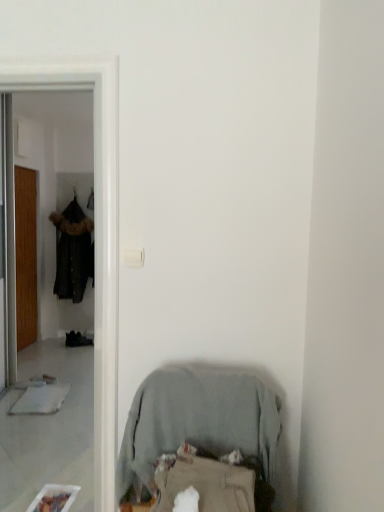
This screenshot has width=384, height=512. What do you see at coordinates (198, 420) in the screenshot?
I see `light gray fabric chair at lower center` at bounding box center [198, 420].

This screenshot has height=512, width=384. Identify the location of transparent plastic screen door at left. (95, 239).

You are a GUI agent. You are given a task and a screenshot of the screen. Output one action in this format:
    pyautogui.click(x=<x>, y=<y>)
    Task: Click on the dark brown fur-trimmed coat at left
    The image size is (384, 512).
    Given the screenshot: What is the action you would take?
    pyautogui.click(x=73, y=252)

Is the surface of dark brown fur-trimmed coat at left in direct contact with light gray fabric chair at lower center?

There is a gap between dark brown fur-trimmed coat at left and light gray fabric chair at lower center.

Consider the image. Can you confirm if dark brown fur-trimmed coat at left is bigger than light gray fabric chair at lower center?

Yes.

Which object is more forward, dark brown fur-trimmed coat at left or light gray fabric chair at lower center?

light gray fabric chair at lower center is in front.

Can light gray fabric chair at lower center be found inside dark brown fur-trimmed coat at left?

No, light gray fabric chair at lower center is located outside of dark brown fur-trimmed coat at left.

Which is behind, point (7, 70) or point (253, 453)?

Positioned behind is point (7, 70).

Considering the positions of objects transparent plastic screen door at left and light gray fabric chair at lower center in the image provided, who is more to the right, transparent plastic screen door at left or light gray fabric chair at lower center?

light gray fabric chair at lower center.

From a real-world perspective, relative to light gray fabric chair at lower center, is transparent plastic screen door at left vertically above or below?

Clearly, from a real-world perspective, transparent plastic screen door at left is above light gray fabric chair at lower center.

Is transparent plastic screen door at left aimed at light gray fabric chair at lower center?

No, transparent plastic screen door at left is not oriented towards light gray fabric chair at lower center.

Which is more to the left, light gray fabric chair at lower center or wooden door at left?

wooden door at left is more to the left.

Is light gray fabric chair at lower center next to wooden door at left and touching it?

No, light gray fabric chair at lower center is not with wooden door at left.

From a real-world perspective, is light gray fabric chair at lower center physically located above or below wooden door at left?

In terms of real-world spatial position, light gray fabric chair at lower center is below wooden door at left.

From a real-world perspective, who is located higher, transparent plastic screen door at left or wooden door at left?

transparent plastic screen door at left, from a real-world perspective.

Which object is more forward, transparent plastic screen door at left or wooden door at left?

transparent plastic screen door at left is closer to the camera.

Looking at this image, what's the angular difference between transparent plastic screen door at left and wooden door at left's facing directions?

90.6 degrees.

This screenshot has height=512, width=384. Identify the location of clothing above the light gray fabric chair at lower center (from a real-world perspective). (73, 252).

Is light gray fabric chair at lower center in contact with dark brown fur-trimmed coat at left?

No, light gray fabric chair at lower center is not touching dark brown fur-trimmed coat at left.

Measure the distance between light gray fabric chair at lower center and dark brown fur-trimmed coat at left.

The distance of light gray fabric chair at lower center from dark brown fur-trimmed coat at left is 12.41 feet.

Does light gray fabric chair at lower center contain dark brown fur-trimmed coat at left?

No, dark brown fur-trimmed coat at left is not inside light gray fabric chair at lower center.

Which object is thinner, transparent plastic screen door at left or dark brown fur-trimmed coat at left?

With smaller width is transparent plastic screen door at left.

Considering the positions of points (29, 84) and (71, 286), is point (29, 84) farther from camera compared to point (71, 286)?

No, it is not.

From the picture: Is transparent plastic screen door at left in front of dark brown fur-trimmed coat at left?

Yes.

Identify the location of clothing lying above the transparent plastic screen door at left (from the image's perspective). The width and height of the screenshot is (384, 512). (73, 252).

From the picture: Is dark brown fur-trimmed coat at left at the back of wooden door at left?

No, dark brown fur-trimmed coat at left is not at the back of wooden door at left.

This screenshot has height=512, width=384. What are the coordinates of `clothing on the right of wooden door at left` in the screenshot? It's located at tap(73, 252).

Relative to dark brown fur-trimmed coat at left, is wooden door at left in front or behind?

wooden door at left is positioned closer to the viewer than dark brown fur-trimmed coat at left.

This screenshot has height=512, width=384. Find the location of `furniture below the dark brown fur-trimmed coat at left (from a real-world perspective)`. furniture below the dark brown fur-trimmed coat at left (from a real-world perspective) is located at coordinates (198, 420).

This screenshot has height=512, width=384. I want to click on screen door lying on the left of light gray fabric chair at lower center, so click(95, 239).

Estimate the real-world distances between objects in this image. Which object is further from dark brown fur-trimmed coat at left, transparent plastic screen door at left or wooden door at left?

Based on the image, transparent plastic screen door at left appears to be further to dark brown fur-trimmed coat at left.

Considering their positions, is dark brown fur-trimmed coat at left positioned further to wooden door at left than transparent plastic screen door at left?

The object further to wooden door at left is transparent plastic screen door at left.

Considering their positions, is wooden door at left positioned further to light gray fabric chair at lower center than transparent plastic screen door at left?

The object further to light gray fabric chair at lower center is wooden door at left.

Looking at the image, which one is located closer to transparent plastic screen door at left, wooden door at left or dark brown fur-trimmed coat at left?

The object closer to transparent plastic screen door at left is wooden door at left.

Which object lies nearer to the anchor point transparent plastic screen door at left, wooden door at left or light gray fabric chair at lower center?

light gray fabric chair at lower center is positioned closer to the anchor transparent plastic screen door at left.

When comparing their distances from transparent plastic screen door at left, does light gray fabric chair at lower center or dark brown fur-trimmed coat at left seem further?

The object further to transparent plastic screen door at left is dark brown fur-trimmed coat at left.

Estimate the real-world distances between objects in this image. Which object is further from light gray fabric chair at lower center, transparent plastic screen door at left or dark brown fur-trimmed coat at left?

The object further to light gray fabric chair at lower center is dark brown fur-trimmed coat at left.

Estimate the real-world distances between objects in this image. Which object is closer to transparent plastic screen door at left, dark brown fur-trimmed coat at left or wooden door at left?

Among the two, wooden door at left is located nearer to transparent plastic screen door at left.

Where is `door between light gray fabric chair at lower center and dark brown fur-trimmed coat at left from front to back`? The image size is (384, 512). door between light gray fabric chair at lower center and dark brown fur-trimmed coat at left from front to back is located at coordinates (26, 255).

Locate an element on the screen. door between transparent plastic screen door at left and dark brown fur-trimmed coat at left along the z-axis is located at coordinates (26, 255).

The height and width of the screenshot is (512, 384). I want to click on screen door between light gray fabric chair at lower center and dark brown fur-trimmed coat at left from front to back, so click(95, 239).

Where is `screen door between light gray fabric chair at lower center and wooden door at left in the front-back direction`? The image size is (384, 512). screen door between light gray fabric chair at lower center and wooden door at left in the front-back direction is located at coordinates (95, 239).